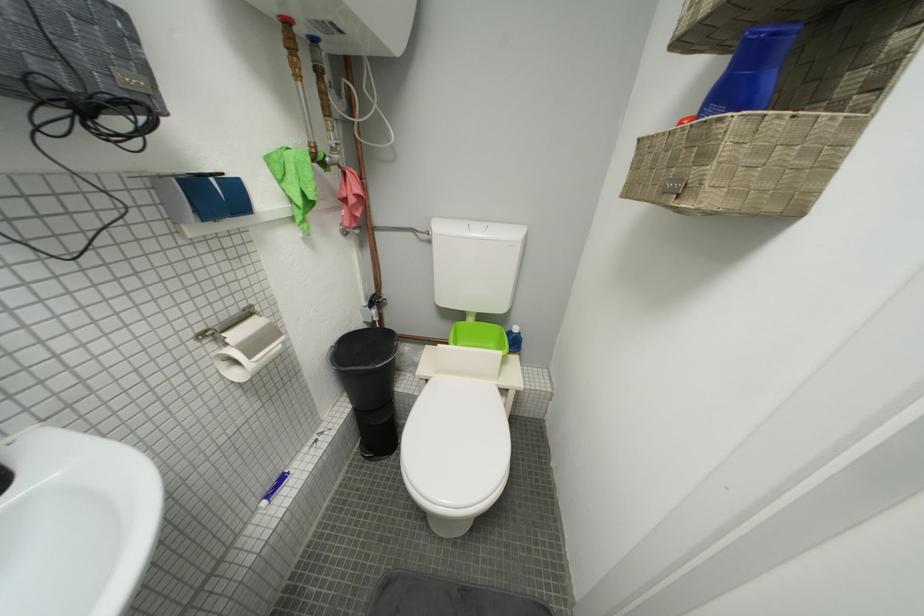
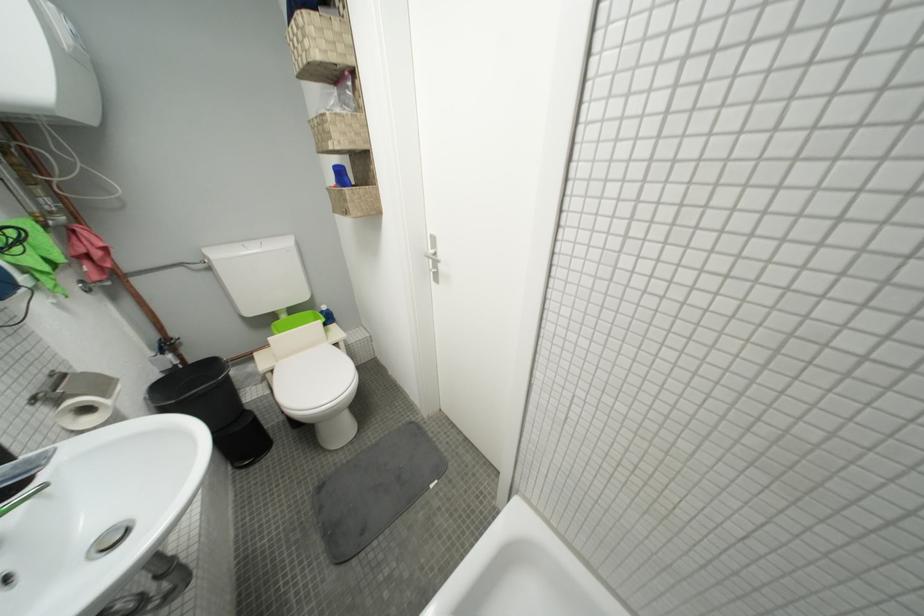
Where in the second image is the point corresponding to point (487, 233) from the first image?

(262, 252)